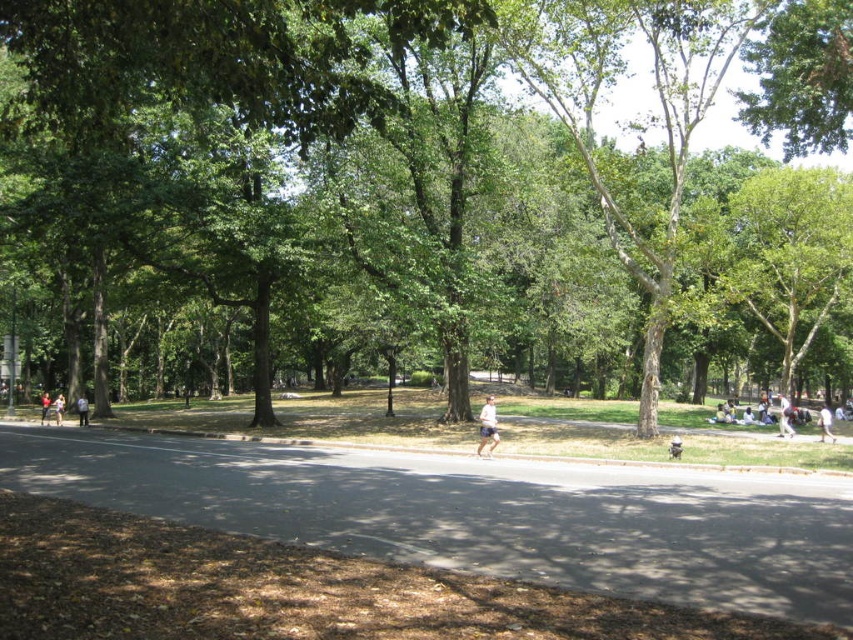
Is point (425, 307) less distant than point (788, 432)?

Yes, it is.

Where is `green leafy tree at center`? green leafy tree at center is located at coordinates (396, 156).

Can you confirm if white cotton shirt at lower right is positioned above white cotton shirt at center?

Yes.

Is point (809, 419) positioned in front of point (820, 417)?

No, (809, 419) is further to viewer.

Is point (821, 406) farther from viewer compared to point (827, 417)?

Yes.

The width and height of the screenshot is (853, 640). Identify the location of white cotton shirt at lower right. (779, 417).

Is light brown leather jacket at left positioned behind light brown leather jacket at center?

No, light brown leather jacket at left is closer to the viewer.

Who is shorter, light brown leather jacket at left or light brown leather jacket at center?

light brown leather jacket at left is shorter.

Which is behind, point (86, 403) or point (45, 397)?

Positioned behind is point (45, 397).

Find the location of a particular element. The width and height of the screenshot is (853, 640). light brown leather jacket at left is located at coordinates (82, 410).